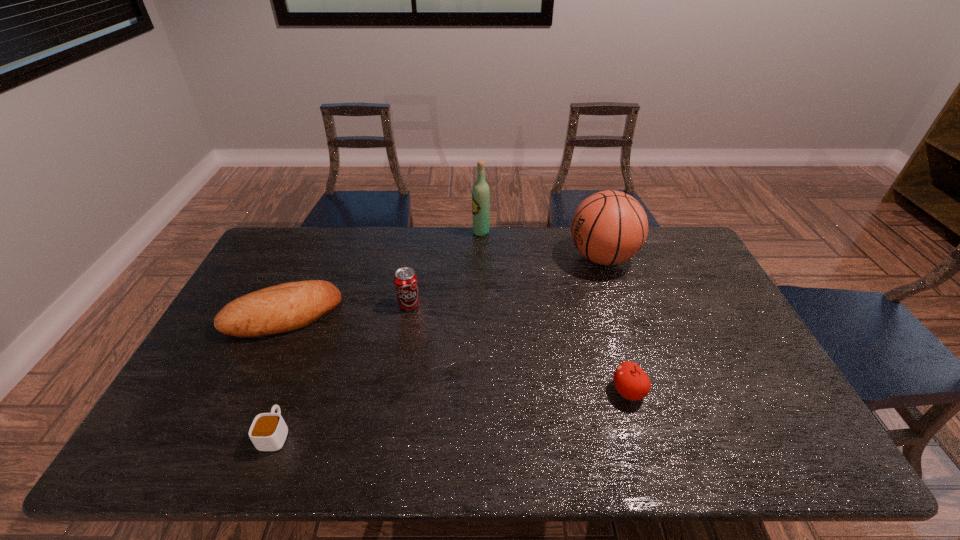
Identify the location of free space located 0.220m on the side with the handle of the cup. The image size is (960, 540). (309, 346).

Image resolution: width=960 pixels, height=540 pixels. What are the coordinates of `wine bottle that is at the far edge` in the screenshot? It's located at (480, 192).

Identify the location of basketball present at the far edge. point(610,227).

This screenshot has height=540, width=960. Find the location of `object positioned at the near edge`. object positioned at the near edge is located at coordinates (268, 432).

Identify the location of object present at the left edge. This screenshot has height=540, width=960. pos(286,307).

This screenshot has width=960, height=540. I want to click on vacant space at the far edge of the desktop, so click(352, 232).

You are a GUI agent. You are given a task and a screenshot of the screen. Output one action in this format:
    pyautogui.click(x=<x>, y=<y>)
    Task: Click on the free space at the near edge of the desktop
    
    Given the screenshot: What is the action you would take?
    pyautogui.click(x=556, y=449)

Identify the location of vacant region at the left edge of the desktop. This screenshot has height=540, width=960. (298, 275).

In the image, there is a desktop. Where is `free region at the right edge`? free region at the right edge is located at coordinates (727, 357).

Where is `free space at the far left corner of the desktop`? This screenshot has height=540, width=960. free space at the far left corner of the desktop is located at coordinates (307, 237).